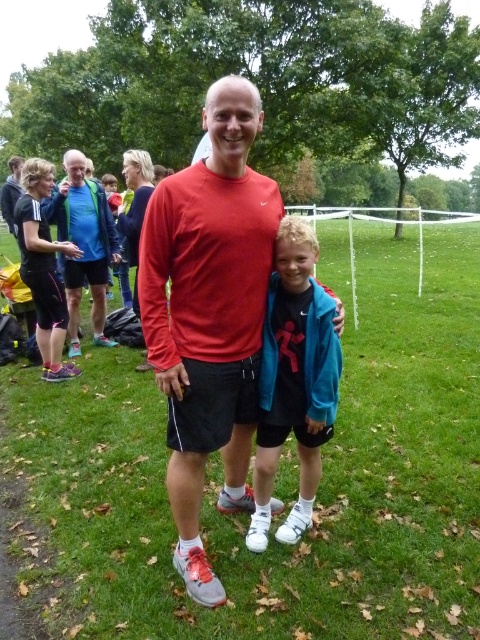
At what (x,y) coordinates should I click in order to perform the action: click on green grass football field at center. Please return your answer as a coordinate pair (x, y). The width and height of the screenshot is (480, 640). Looking at the image, I should click on (319, 486).

Is point (394, 608) behind point (13, 221)?

No, it is not.

The width and height of the screenshot is (480, 640). In order to click on green grass football field at center in this screenshot , I will do `click(319, 486)`.

Looking at this image, which of these two, matte red long-sleeve shirt at center or matte blue jacket at left, stands shorter?

Standing shorter between the two is matte red long-sleeve shirt at center.

Is point (248, 282) positioned in front of point (52, 196)?

Yes, point (248, 282) is in front of point (52, 196).

Does point (200, 497) lie behind point (60, 221)?

No.

The image size is (480, 640). Find the location of `matte red long-sleeve shirt at center`. matte red long-sleeve shirt at center is located at coordinates pos(210,314).

Is green grass football field at center shorter than matte red long-sleeve shirt at center?

No, green grass football field at center is not shorter than matte red long-sleeve shirt at center.

Is point (471, 492) positioned in front of point (192, 342)?

That is False.

Identify the location of green grass football field at center. (319, 486).